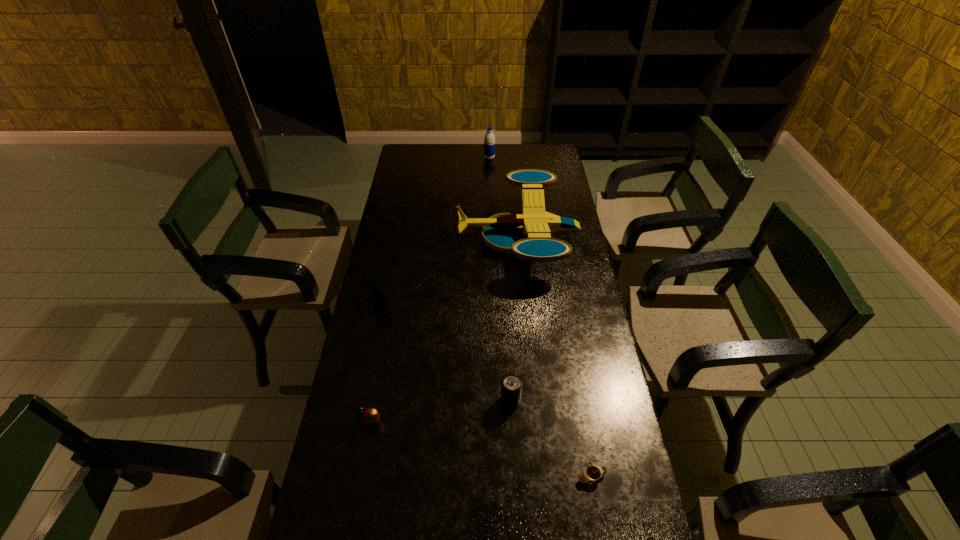
This screenshot has width=960, height=540. In order to click on watch present at the right edge in this screenshot , I will do `click(592, 473)`.

Where is `free space at the far edge of the desktop`? free space at the far edge of the desktop is located at coordinates (481, 165).

Identify the location of vacant space at the left edge of the desktop. The image size is (960, 540). (417, 180).

Find the location of a particular element. vacant space at the right edge of the desktop is located at coordinates (568, 287).

This screenshot has height=540, width=960. I want to click on vacant space at the far left corner, so click(x=425, y=154).

Where is `vacant area between the drone and the watch`? vacant area between the drone and the watch is located at coordinates (555, 358).

This screenshot has height=540, width=960. In order to click on vacant area that lies between the alarm clock and the water bottle in this screenshot , I will do `click(430, 290)`.

Image resolution: width=960 pixels, height=540 pixels. I want to click on free spot between the drone and the second nearest object, so click(444, 330).

The height and width of the screenshot is (540, 960). Find the location of `unoccupied position between the fourth farthest object and the farthest object`. unoccupied position between the fourth farthest object and the farthest object is located at coordinates (500, 279).

In order to click on free space that is in between the pop soda and the water bottle in this screenshot , I will do `click(500, 279)`.